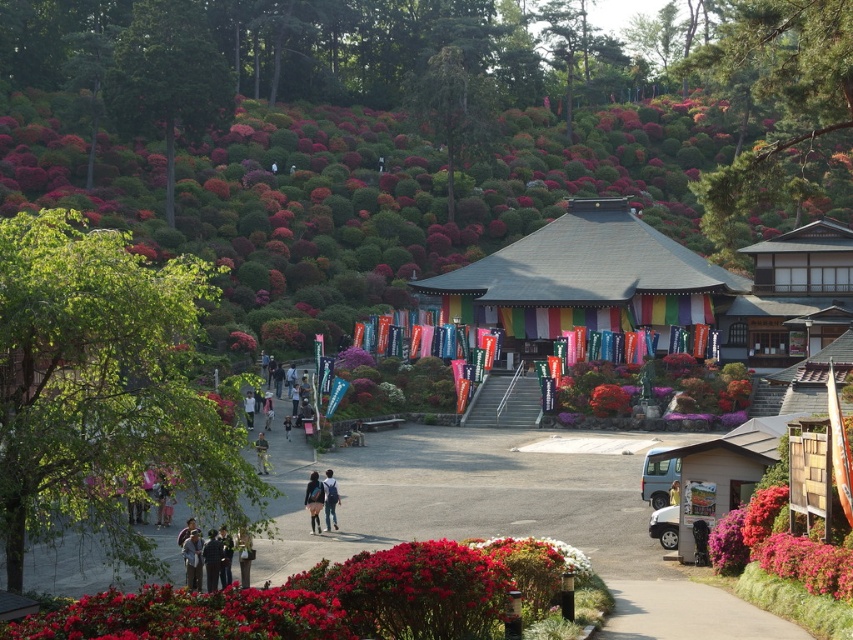
Describe the element at coordinates (103, 390) in the screenshot. Image resolution: width=853 pixels, height=640 pixels. I see `green leafy tree at left` at that location.

Looking at this image, can you confirm if green leafy tree at left is positioned below denim jacket at lower center?

Incorrect, green leafy tree at left is not positioned below denim jacket at lower center.

Between point (26, 269) and point (317, 504), which one is positioned behind?

Point (317, 504)

What are the coordinates of `green leafy tree at left` in the screenshot? It's located at (103, 390).

Who is lower down, vivid red petals at center or light brown leather jacket at lower center?

light brown leather jacket at lower center is below.

Does point (610, 412) come closer to viewer compared to point (264, 442)?

No, it is behind (264, 442).

Who is more forward, (598,404) or (263,474)?

Point (263,474) is more forward.

What are the coordinates of `vivid red petals at center` in the screenshot? It's located at (608, 401).

Does dark gray pants at lower center have a larger size compared to yellow fabric person at center?

Indeed, dark gray pants at lower center has a larger size compared to yellow fabric person at center.

Is dark gray pants at lower center thinner than yellow fabric person at center?

No, dark gray pants at lower center is not thinner than yellow fabric person at center.

Who is more distant from viewer, (241, 548) or (674, 486)?

The point (674, 486) is behind.

Identify the location of dark gray pants at lower center. (244, 556).